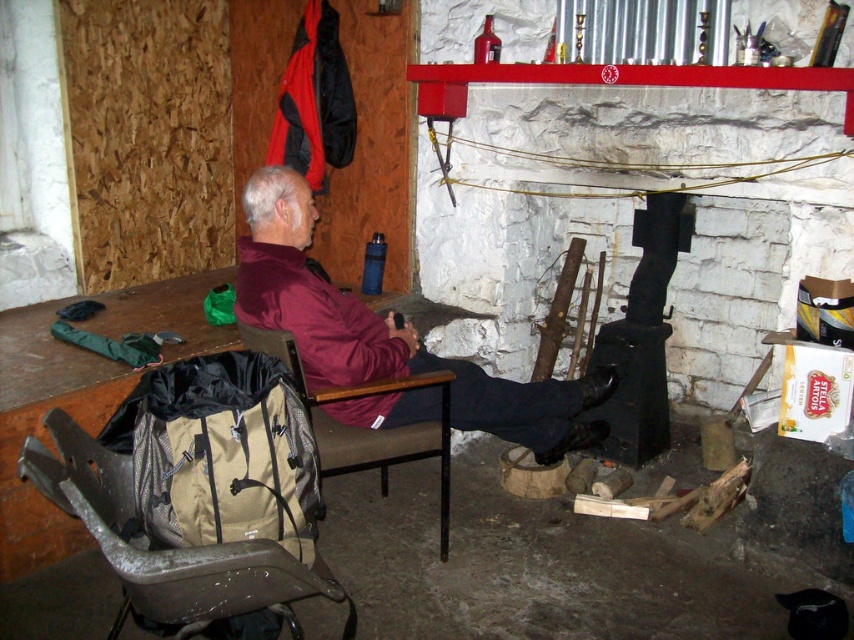
Question: From the image, what is the correct spatial relationship of maroon fabric jacket at center in relation to brown fabric chair at left?

Choices:
 (A) left
 (B) right

Answer: (B)

Question: Can you confirm if red/black jacket at upper left is positioned above brown fabric chair at left?

Choices:
 (A) no
 (B) yes

Answer: (B)

Question: Which point is farther to the camera?

Choices:
 (A) brown fabric chair at left
 (B) beige fabric folding chair at lower left
 (C) maroon fabric jacket at center

Answer: (C)

Question: Which object appears closest to the camera in this image?

Choices:
 (A) beige fabric folding chair at lower left
 (B) brown fabric chair at left

Answer: (A)

Question: Is beige fabric folding chair at lower left wider than brown fabric chair at left?

Choices:
 (A) no
 (B) yes

Answer: (B)

Question: Based on their relative distances, which object is nearer to the maroon fabric jacket at center?

Choices:
 (A) brown fabric chair at left
 (B) beige fabric folding chair at lower left
 (C) red/black jacket at upper left

Answer: (A)